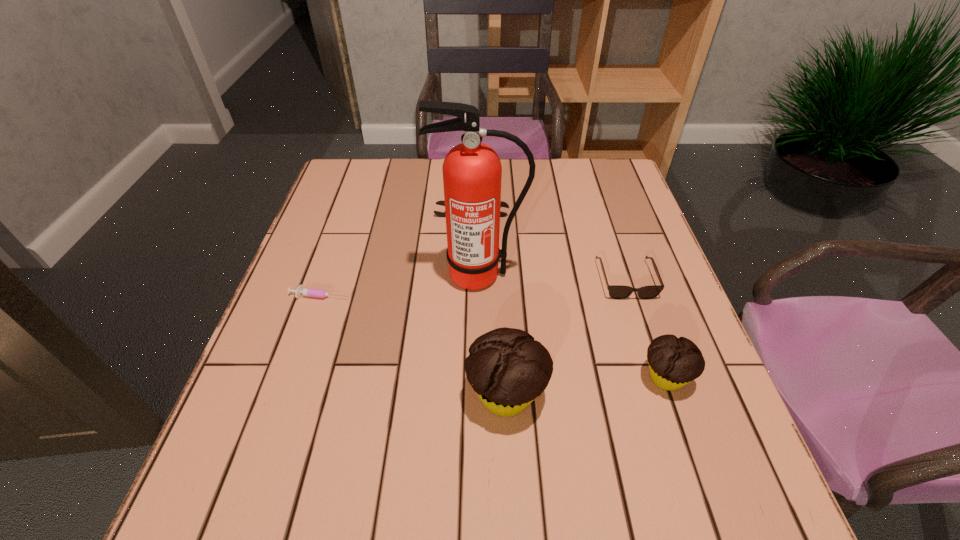
This screenshot has height=540, width=960. What are the coordinates of `free space between the farthest object and the fifth shortest object` in the screenshot? It's located at (489, 306).

Point out which object is positioned as the third nearest to the shorter muffin. Please provide its 2D coordinates. Your answer should be formatted as a tuple, i.e. [(x, y)], where the tuple contains the x and y coordinates of a point satisfying the conditions above.

[(472, 172)]

Find the location of `object that stands as the third closest to the right muffin`. object that stands as the third closest to the right muffin is located at coordinates (472, 172).

Where is `free point that satisfies the following two spatial constraints: 1. at the front lenses of the sunglasses; 2. on the left side of the shorter muffin`? This screenshot has height=540, width=960. free point that satisfies the following two spatial constraints: 1. at the front lenses of the sunglasses; 2. on the left side of the shorter muffin is located at coordinates (658, 377).

Locate an element on the screen. vacant position in the image that satisfies the following two spatial constraints: 1. on the handle side of the shorter muffin; 2. on the right side of the tallest object is located at coordinates (479, 377).

The height and width of the screenshot is (540, 960). Find the location of `free spot that satisfies the following two spatial constraints: 1. on the handle side of the fire extinguisher; 2. on the left side of the right muffin`. free spot that satisfies the following two spatial constraints: 1. on the handle side of the fire extinguisher; 2. on the left side of the right muffin is located at coordinates (479, 377).

Where is `vacant region that satisfies the following two spatial constraints: 1. at the front lenses of the sunglasses; 2. on the left side of the shorter muffin`? The height and width of the screenshot is (540, 960). vacant region that satisfies the following two spatial constraints: 1. at the front lenses of the sunglasses; 2. on the left side of the shorter muffin is located at coordinates (658, 377).